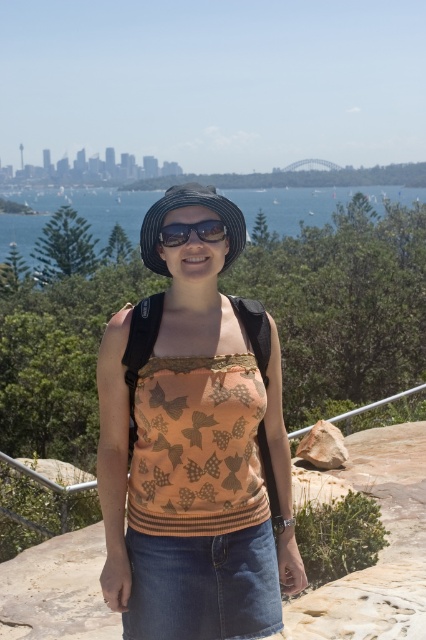
Question: Which object is farther from the camera taking this photo?

Choices:
 (A) black woven hat at center
 (B) matte black hat at center
 (C) blue water at center

Answer: (C)

Question: Which is nearer to the black woven hat at center?

Choices:
 (A) blue water at center
 (B) matte black hat at center

Answer: (B)

Question: Where is black woven hat at center located in relation to matte black sunglasses at center in the image?

Choices:
 (A) right
 (B) left

Answer: (B)

Question: Is blue water at center further to camera compared to black woven hat at center?

Choices:
 (A) no
 (B) yes

Answer: (B)

Question: Which point appears farthest from the camera in this image?

Choices:
 (A) (176, 188)
 (B) (186, 227)

Answer: (A)

Question: Is matte black hat at center below matte black sunglasses at center?

Choices:
 (A) no
 (B) yes

Answer: (B)